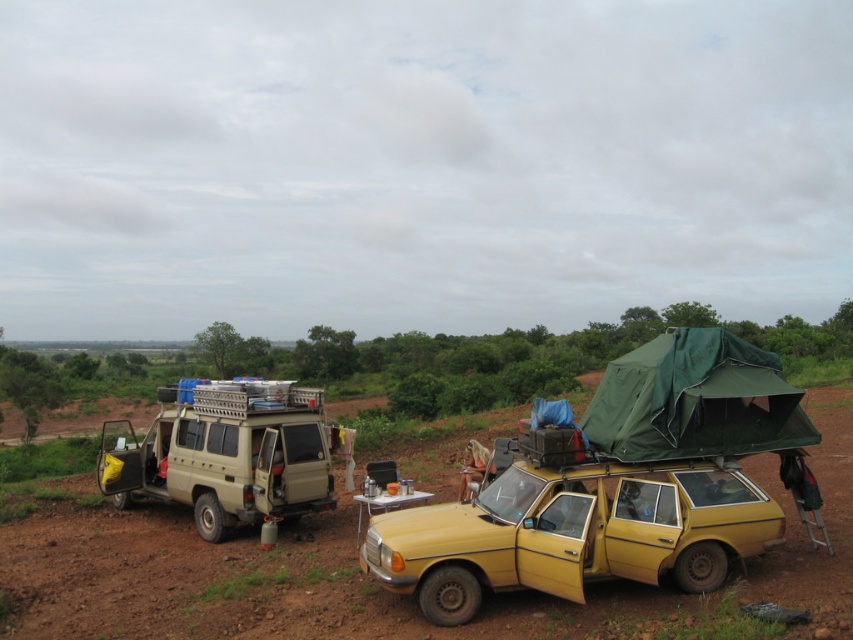
You are driving a car and want to exit the camping area. You see the brown dirt track at lower left and the yellow matte car at center. Which path should you take to leave the camping area?

The brown dirt track at lower left is in front of the yellow matte car at center, so you should take the brown dirt track at lower left to exit the camping area as it is the path leading forward.

You are setting up camp and need to place a new tent. The beige matte van at left is in the way of where you want to put the green fabric tent at upper right. Can you move the van to make space?

The beige matte van at left is located below the green fabric tent at upper right, so moving the van may not be necessary as the tent is already positioned above it.